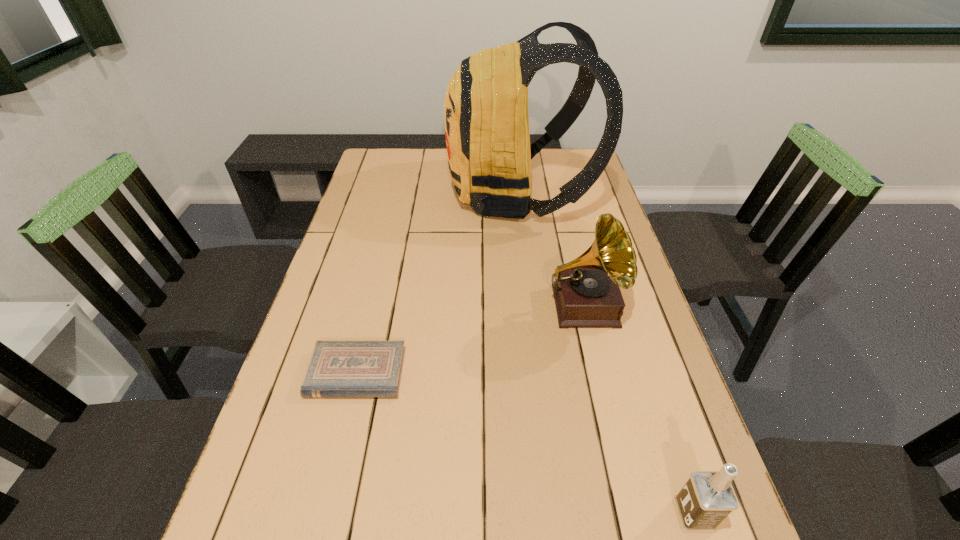
Identify the location of vacant area that lies between the leftmost object and the farthest object. (438, 284).

What are the coordinates of `vacant point located between the second tallest object and the vodka` in the screenshot? It's located at (638, 410).

Where is `free space between the Bible and the tallest object`? free space between the Bible and the tallest object is located at coordinates (438, 284).

Identify the location of blank region between the tallest object and the leftmost object. (438, 284).

You are a GUI agent. You are given a task and a screenshot of the screen. Output one action in this format:
    pyautogui.click(x=<x>, y=<y>)
    Task: Click on the vacant space in between the shortest object and the backpack
    Image resolution: width=960 pixels, height=540 pixels.
    Given the screenshot: What is the action you would take?
    pyautogui.click(x=438, y=284)

At what (x,y) coordinates should I click in order to perform the action: click on free point between the shortest object and the tallest object. Please return your answer as a coordinate pair (x, y). This screenshot has height=540, width=960. Looking at the image, I should click on (438, 284).

The image size is (960, 540). What are the coordinates of `free space between the leftmost object and the phonograph record` in the screenshot? It's located at (470, 340).

Locate an element on the screen. The width and height of the screenshot is (960, 540). the closest object to the nearest object is located at coordinates (586, 290).

This screenshot has width=960, height=540. Find the location of `object that is the closest one to the third shortest object`. object that is the closest one to the third shortest object is located at coordinates (486, 118).

The image size is (960, 540). In order to click on free space that satisfies the following two spatial constraints: 1. on the front-facing side of the backpack; 2. on the spine side of the shortest object in this screenshot , I will do `click(540, 374)`.